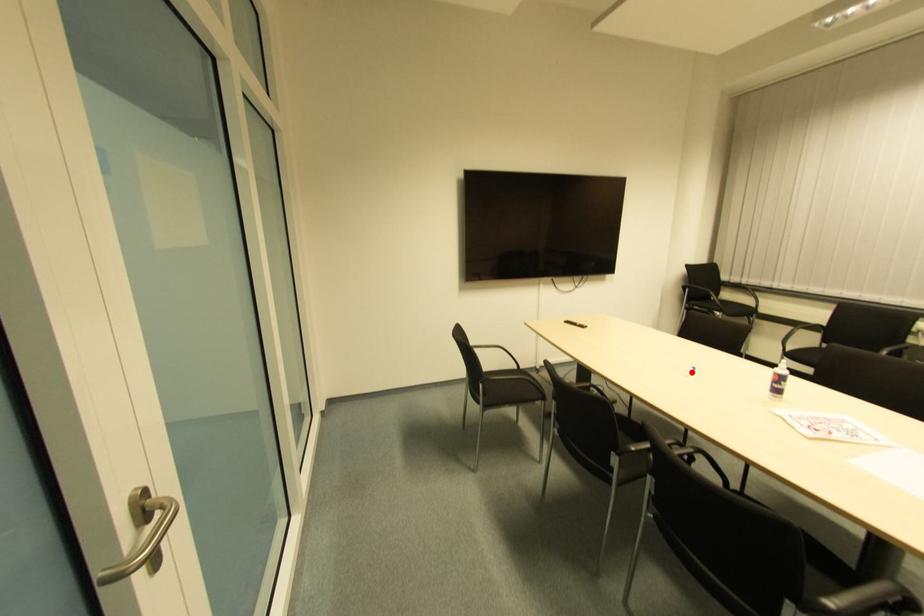
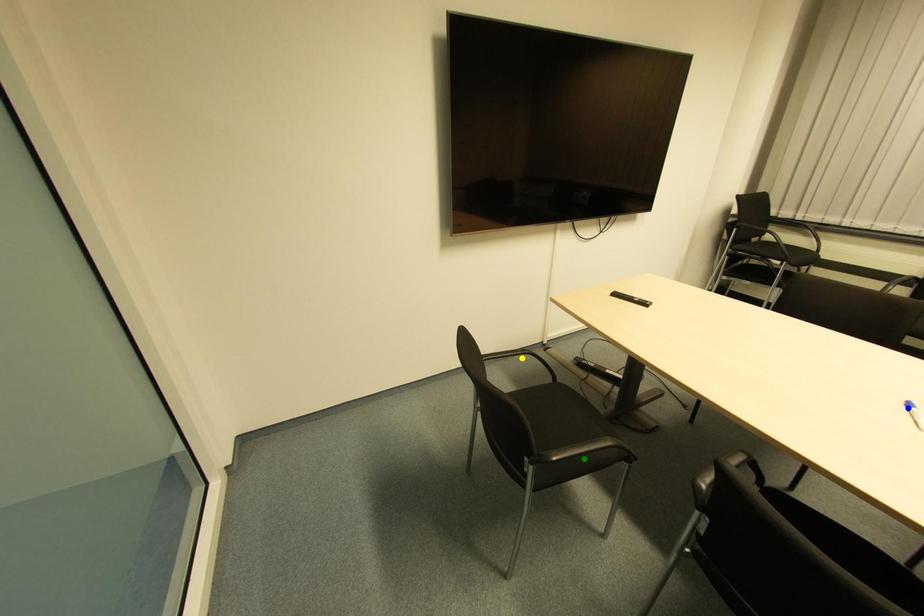
Question: I am providing you with two images of the same scene from different viewpoints. A red point is marked on the first image. You are given multiple points on the second image. Which mark in image 2 goes with the point in image 1?

Choices:
 (A) yellow point
 (B) blue point
 (C) green point

Answer: (B)